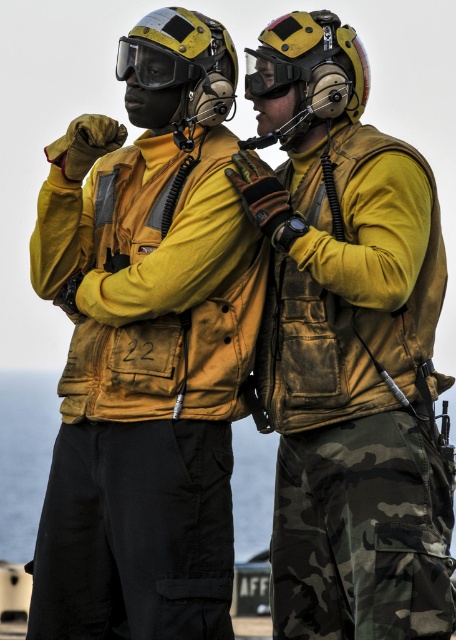
Does yellow matte helmet at upper center appear on the right side of matte yellow helmet at upper center?

Correct, you'll find yellow matte helmet at upper center to the right of matte yellow helmet at upper center.

Who is positioned more to the left, yellow matte helmet at upper center or matte yellow helmet at upper center?

Positioned to the left is matte yellow helmet at upper center.

Locate an element on the screen. This screenshot has height=640, width=456. yellow matte helmet at upper center is located at coordinates (307, 72).

Identify the location of yellow matte helmet at upper center. The image size is (456, 640). (307, 72).

Which is below, matte yellow helmet at upper center or transparent plastic goggles at upper center?

transparent plastic goggles at upper center

Is matte yellow helmet at upper center positioned at the back of transparent plastic goggles at upper center?

No, matte yellow helmet at upper center is in front of transparent plastic goggles at upper center.

Who is more distant from viewer, (131, 32) or (154, 49)?

The point (131, 32) is behind.

I want to click on matte yellow helmet at upper center, so click(x=182, y=65).

How distant is yellow matte helmet at upper center from transparent plastic goggles at upper center?

3.28 meters

Does point (286, 48) come farther from viewer compared to point (139, 56)?

No, it is not.

Find the location of a particular element. This screenshot has height=640, width=456. yellow matte helmet at upper center is located at coordinates click(307, 72).